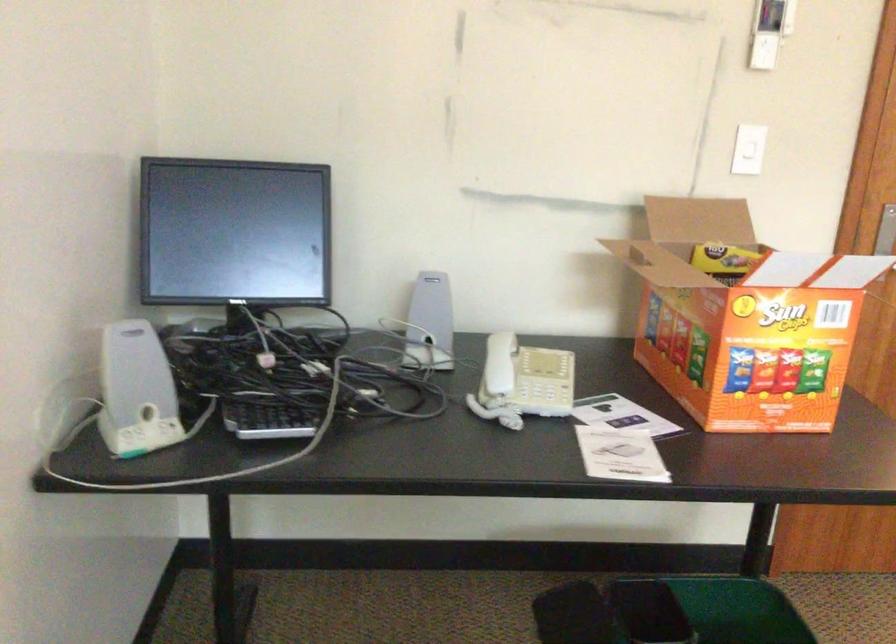
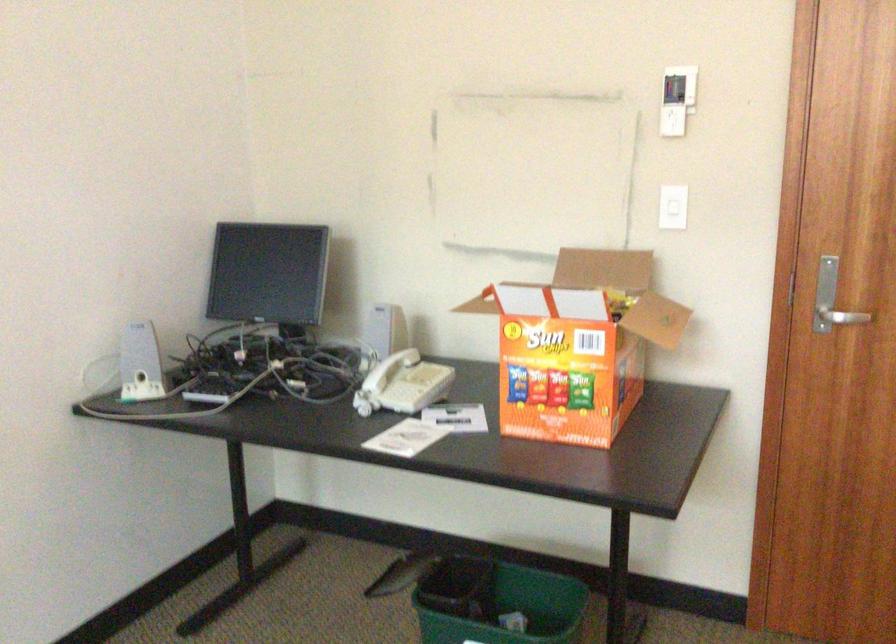
Find the pixel in the second image that matches pixel 496 383 in the first image.

(376, 383)